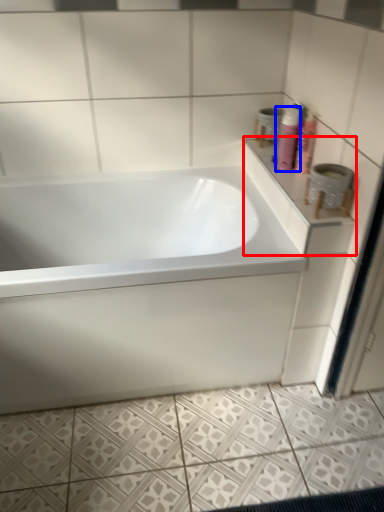
Question: Among these objects, which one is farthest to the camera, counter top (highlighted by a red box) or shaving cream (highlighted by a blue box)?

Choices:
 (A) counter top
 (B) shaving cream

Answer: (B)